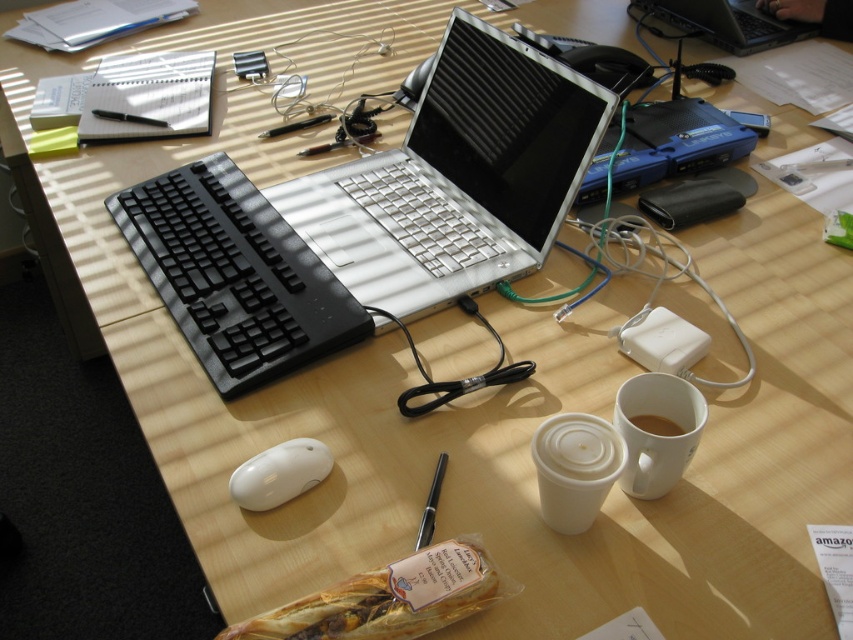
Question: Does translucent plastic baguette at center have a larger size compared to white matte cup at center?

Choices:
 (A) yes
 (B) no

Answer: (A)

Question: Does white matte cup at center appear over silver metallic laptop at upper right?

Choices:
 (A) yes
 (B) no

Answer: (B)

Question: Does translucent plastic baguette at center have a larger size compared to white glossy mouse at center?

Choices:
 (A) no
 (B) yes

Answer: (B)

Question: Which object is the closest to the silver metallic laptop at center?

Choices:
 (A) metallic pen at center
 (B) translucent plastic baguette at center
 (C) white matte mug at center-right

Answer: (A)

Question: Which point is closer to the camera?

Choices:
 (A) black rubberized keyboard at center-left
 (B) white matte mug at center-right

Answer: (B)

Question: Which object is closer to the camera taking this photo?

Choices:
 (A) translucent plastic baguette at center
 (B) white matte cup at center

Answer: (A)